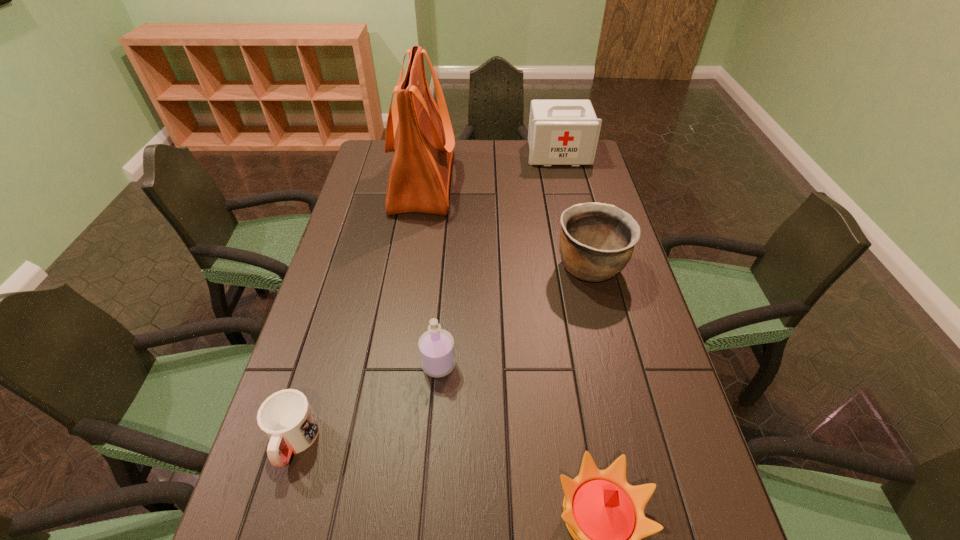
Where is `shopping bag`? The width and height of the screenshot is (960, 540). shopping bag is located at coordinates (423, 140).

This screenshot has height=540, width=960. What are the coordinates of `the fifth shortest object` in the screenshot? It's located at (561, 132).

This screenshot has width=960, height=540. I want to click on perfume, so click(x=436, y=346).

The height and width of the screenshot is (540, 960). I want to click on pottery, so click(x=597, y=240).

Where is `the leftmost object`? This screenshot has width=960, height=540. the leftmost object is located at coordinates (286, 417).

You are a GUI agent. You are given a task and a screenshot of the screen. Output one action in this format:
    pyautogui.click(x=<x>, y=<y>)
    Task: Click on the shortest object
    The image size is (960, 540).
    Given the screenshot: What is the action you would take?
    pyautogui.click(x=286, y=417)

Where is `vacant space situated on the front pocket of the tallest object`? The width and height of the screenshot is (960, 540). vacant space situated on the front pocket of the tallest object is located at coordinates (550, 181).

You are a GUI agent. You are given a task and a screenshot of the screen. Output one action in this format:
    pyautogui.click(x=<x>, y=<y>)
    Task: Click on the free region located on the front-facing side of the second tallest object
    This screenshot has width=960, height=540.
    Given the screenshot: What is the action you would take?
    pyautogui.click(x=569, y=201)

Locate an element on the screen. The width and height of the screenshot is (960, 540). vacant space located 0.230m on the right of the perfume is located at coordinates (548, 364).

At what (x,y) coordinates should I click in order to perform the action: click on free point located 0.100m on the left of the pottery. Please return your answer as a coordinate pair (x, y). Looking at the image, I should click on (521, 267).